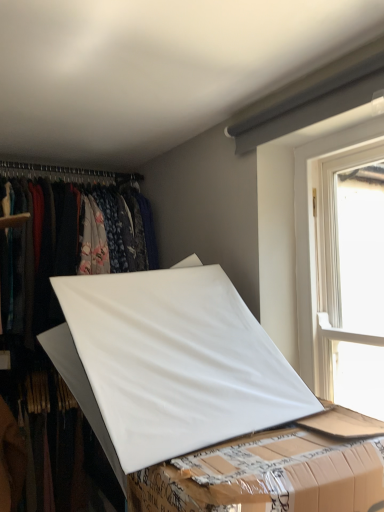
Question: In the image, is white plastic window at upper right on the left side or the right side of white matte board at center?

Choices:
 (A) right
 (B) left

Answer: (A)

Question: From the image's perspective, is white plastic window at upper right above or below white matte board at center?

Choices:
 (A) below
 (B) above

Answer: (B)

Question: Which object is positioned farthest from the white plastic window at upper right?

Choices:
 (A) white matte board at center
 (B) white matte board at center

Answer: (B)

Question: Which of these objects is positioned farthest from the white matte board at center?

Choices:
 (A) white matte board at center
 (B) white plastic window at upper right

Answer: (B)